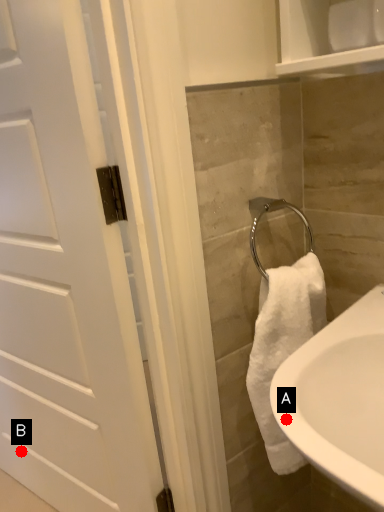
Question: Two points are circled on the image, labeled by A and B beside each circle. Which of the following is the farthest from the observer?

Choices:
 (A) A is further
 (B) B is further

Answer: (B)